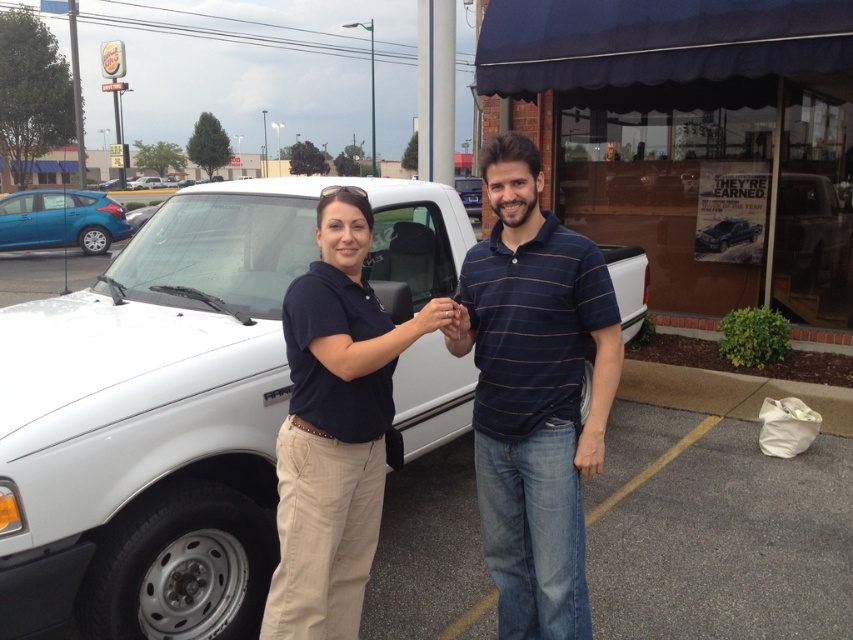
Describe the element at coordinates (177, 406) in the screenshot. This screenshot has width=853, height=640. I see `white matte truck at center` at that location.

Is point (161, 500) positioned in front of point (125, 236)?

Yes, it is.

Is point (196, 369) behind point (21, 221)?

No, it is in front of (21, 221).

Identify the location of white matte truck at center. The width and height of the screenshot is (853, 640). (177, 406).

Is blue striped polo shirt at center to the right of metallic blue hatchback at left from the viewer's perspective?

Indeed, blue striped polo shirt at center is positioned on the right side of metallic blue hatchback at left.

Measure the distance between blue striped polo shirt at center and camera.

The distance of blue striped polo shirt at center from camera is 2.16 meters.

The height and width of the screenshot is (640, 853). I want to click on blue striped polo shirt at center, so click(534, 394).

Does metallic blue hatchback at left have a lesser width compared to metallic silver truck at center?

Yes, metallic blue hatchback at left is thinner than metallic silver truck at center.

Can you confirm if metallic blue hatchback at left is positioned above metallic silver truck at center?

Indeed, metallic blue hatchback at left is positioned over metallic silver truck at center.

Between point (71, 193) and point (746, 225), which one is positioned behind?

Positioned behind is point (71, 193).

Where is `metallic blue hatchback at left`? metallic blue hatchback at left is located at coordinates (61, 220).